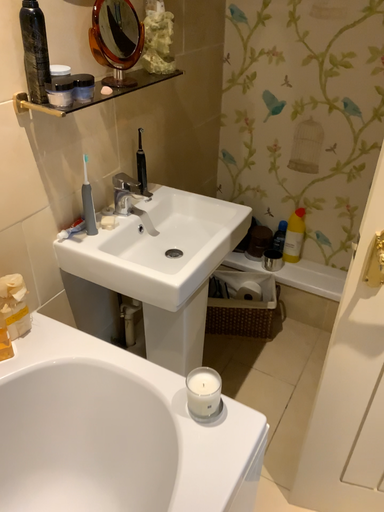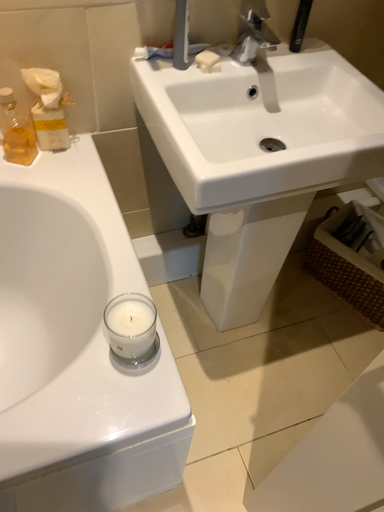
Question: How did the camera likely rotate when shooting the video?

Choices:
 (A) rotated upward
 (B) rotated downward

Answer: (B)